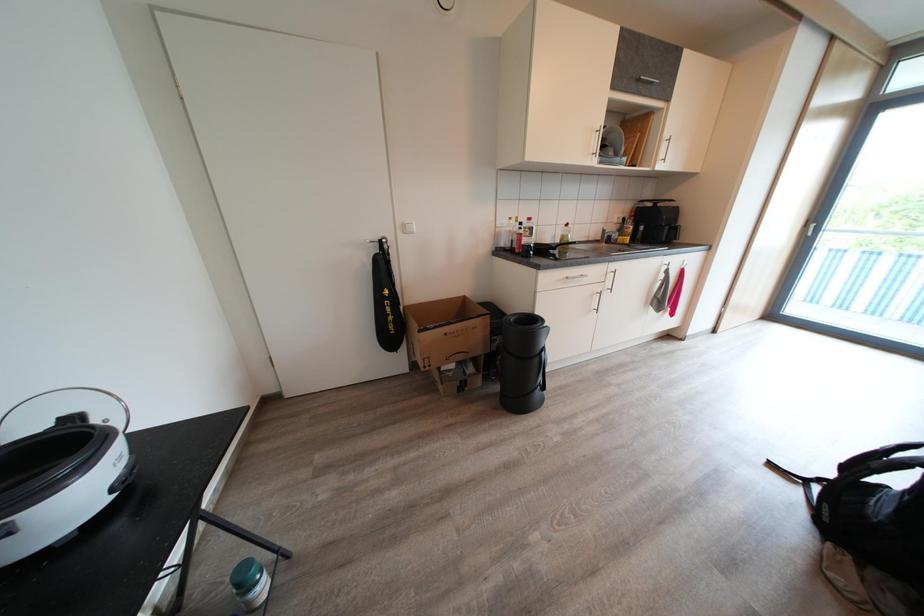
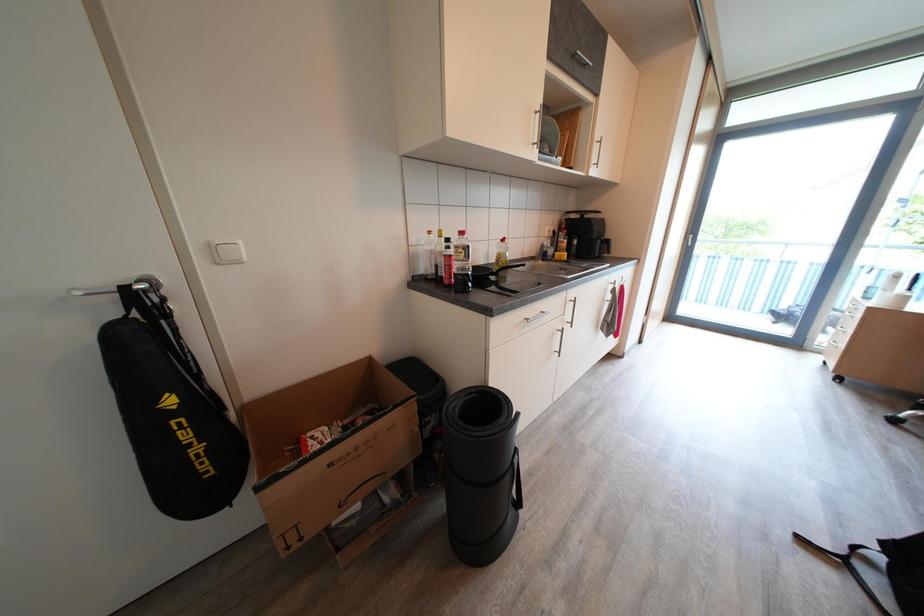
Question: The images are taken continuously from a first-person perspective. In which direction are you moving?

Choices:
 (A) Left
 (B) Right
 (C) Forward
 (D) Backward

Answer: (C)